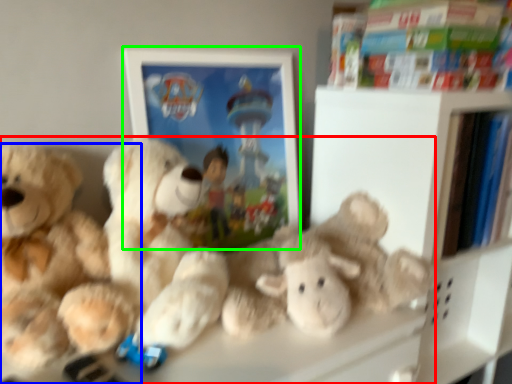
Question: Which object is positioned closest to teddy bear (highlighted by a red box)? Select from teddy bear (highlighted by a blue box) and picture frame (highlighted by a green box).

Choices:
 (A) teddy bear
 (B) picture frame

Answer: (A)